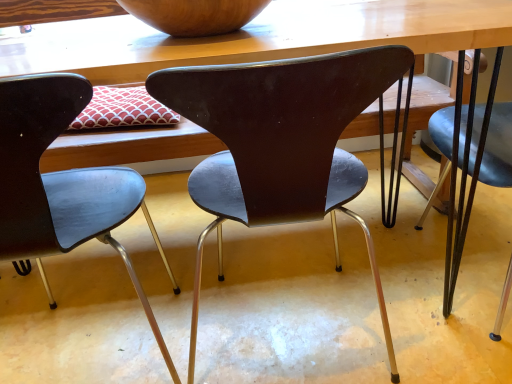
Describe the element at coordinates (61, 184) in the screenshot. I see `matte black chair at center, the 2th chair positioned from the right` at that location.

Locate an element on the screen. The width and height of the screenshot is (512, 384). wooden table at center is located at coordinates (258, 37).

This screenshot has width=512, height=384. Find the location of `table that appears above the matte black chair at center, positioned as the 2th chair in left-to-right order (from the image's perspective)`. table that appears above the matte black chair at center, positioned as the 2th chair in left-to-right order (from the image's perspective) is located at coordinates (258, 37).

Which of these two, wooden table at center or matte black chair at center, positioned as the 2th chair in left-to-right order, is smaller?

Smaller between the two is matte black chair at center, positioned as the 2th chair in left-to-right order.

Looking at this image, is wooden table at center oriented away from matte black chair at center, positioned as the 2th chair in left-to-right order?

Yes, wooden table at center's orientation is away from matte black chair at center, positioned as the 2th chair in left-to-right order.

Is wooden table at center completely or partially outside of matte black chair at center, positioned as the first chair in right-to-left order?

wooden table at center is positioned outside matte black chair at center, positioned as the first chair in right-to-left order.

Which is in front, point (196, 150) or point (42, 92)?

The point (42, 92) is closer.

Is wooden table at center positioned far away from matte black chair at center, the 2th chair positioned from the right?

That's not correct — wooden table at center is a little close to matte black chair at center, the 2th chair positioned from the right.

Considering the relative positions of wooden table at center and matte black chair at center, the 2th chair positioned from the right, in the image provided, is wooden table at center to the left of matte black chair at center, the 2th chair positioned from the right, from the viewer's perspective?

No, wooden table at center is not to the left of matte black chair at center, the 2th chair positioned from the right.

Based on the photo, considering the sizes of wooden table at center and matte black chair at center, which is the 1th chair from left to right, in the image, is wooden table at center wider or thinner than matte black chair at center, which is the 1th chair from left to right,?

Clearly, wooden table at center has more width compared to matte black chair at center, which is the 1th chair from left to right.

Does matte black chair at center, positioned as the first chair in right-to-left order, have a greater height compared to wooden bowl at upper center?

Yes.

Between matte black chair at center, positioned as the first chair in right-to-left order, and wooden bowl at upper center, which one has larger size?

Bigger between the two is matte black chair at center, positioned as the first chair in right-to-left order.

From a real-world perspective, which object rests below the other?

matte black chair at center, positioned as the first chair in right-to-left order, from a real-world perspective.

Looking at this image, is matte black chair at center, positioned as the first chair in right-to-left order, wider than wooden bowl at upper center?

Correct, the width of matte black chair at center, positioned as the first chair in right-to-left order, exceeds that of wooden bowl at upper center.

Is matte black chair at center, which is the 1th chair from left to right, at the left side of wooden bowl at upper center?

Yes.

Does matte black chair at center, the 2th chair positioned from the right, have a larger size compared to wooden bowl at upper center?

Yes, matte black chair at center, the 2th chair positioned from the right, is bigger than wooden bowl at upper center.

Is matte black chair at center, the 2th chair positioned from the right, aimed at wooden bowl at upper center?

No.

Are matte black chair at center, which is the 1th chair from left to right, and wooden bowl at upper center making contact?

matte black chair at center, which is the 1th chair from left to right, is not next to wooden bowl at upper center, and they're not touching.

Which object is wider, matte black chair at center, the 2th chair positioned from the right, or matte black chair at center, positioned as the 2th chair in left-to-right order?

Wider between the two is matte black chair at center, the 2th chair positioned from the right.

In the scene shown: How many degrees apart are the facing directions of matte black chair at center, which is the 1th chair from left to right, and matte black chair at center, positioned as the 2th chair in left-to-right order?

They differ by 5.83e-05 degrees in their facing directions.

Between point (25, 155) and point (245, 124), which one is positioned behind?

The point (25, 155) is farther.

Is matte black chair at center, the 2th chair positioned from the right, in contact with matte black chair at center, positioned as the first chair in right-to-left order?

They are not placed beside each other.

Consider the image. Is matte black chair at center, positioned as the first chair in right-to-left order, aimed at wooden table at center?

Yes, matte black chair at center, positioned as the first chair in right-to-left order, faces towards wooden table at center.

From the image's perspective, is matte black chair at center, positioned as the first chair in right-to-left order, above wooden table at center?

No, from the image's perspective, matte black chair at center, positioned as the first chair in right-to-left order, is not over wooden table at center.

Can you confirm if matte black chair at center, positioned as the first chair in right-to-left order, is shorter than wooden table at center?

Correct, matte black chair at center, positioned as the first chair in right-to-left order, is not as tall as wooden table at center.

Is point (156, 14) less distant than point (195, 139)?

That is True.

Considering the sizes of objects wooden bowl at upper center and wooden table at center in the image provided, who is bigger, wooden bowl at upper center or wooden table at center?

wooden table at center.

Who is more distant, wooden bowl at upper center or wooden table at center?

Positioned behind is wooden bowl at upper center.

How many degrees apart are the facing directions of wooden bowl at upper center and wooden table at center?

wooden bowl at upper center and wooden table at center are facing 3.6 degrees away from each other.

In order to click on table behind the matte black chair at center, positioned as the first chair in right-to-left order in this screenshot , I will do `click(258, 37)`.

Locate an element on the screen. table located above the matte black chair at center, the 2th chair positioned from the right (from the image's perspective) is located at coordinates (258, 37).

Which object lies nearer to the anchor point wooden table at center, wooden bowl at upper center or matte black chair at center, positioned as the 2th chair in left-to-right order?

Among the two, wooden bowl at upper center is located nearer to wooden table at center.

Considering their positions, is wooden table at center positioned further to matte black chair at center, which is the 1th chair from left to right, than wooden bowl at upper center?

Among the two, wooden bowl at upper center is located further to matte black chair at center, which is the 1th chair from left to right.

Consider the image. Which object lies nearer to the anchor point matte black chair at center, which is the 1th chair from left to right, wooden bowl at upper center or wooden table at center?

wooden table at center lies closer to matte black chair at center, which is the 1th chair from left to right, than the other object.

Estimate the real-world distances between objects in this image. Which object is further from wooden bowl at upper center, matte black chair at center, which is the 1th chair from left to right, or wooden table at center?

matte black chair at center, which is the 1th chair from left to right, is positioned further to the anchor wooden bowl at upper center.

Based on their spatial positions, is matte black chair at center, the 2th chair positioned from the right, or wooden bowl at upper center further from matte black chair at center, positioned as the first chair in right-to-left order?

wooden bowl at upper center is positioned further to the anchor matte black chair at center, positioned as the first chair in right-to-left order.

When comparing their distances from wooden bowl at upper center, does matte black chair at center, positioned as the first chair in right-to-left order, or matte black chair at center, the 2th chair positioned from the right, seem closer?

matte black chair at center, positioned as the first chair in right-to-left order, is positioned closer to the anchor wooden bowl at upper center.

Which object lies further to the anchor point matte black chair at center, which is the 1th chair from left to right, matte black chair at center, positioned as the first chair in right-to-left order, or wooden table at center?

wooden table at center.

From the image, which object appears to be farther from wooden bowl at upper center, matte black chair at center, which is the 1th chair from left to right, or matte black chair at center, positioned as the first chair in right-to-left order?

matte black chair at center, which is the 1th chair from left to right, is positioned further to the anchor wooden bowl at upper center.

Find the location of a particular element. table situated between matte black chair at center, the 2th chair positioned from the right, and matte black chair at center, positioned as the first chair in right-to-left order, from left to right is located at coordinates (258, 37).

Locate an element on the screen. Image resolution: width=512 pixels, height=384 pixels. table between wooden bowl at upper center and matte black chair at center, positioned as the 2th chair in left-to-right order, in the vertical direction is located at coordinates (258, 37).

The height and width of the screenshot is (384, 512). What are the coordinates of `table between wooden bowl at upper center and matte black chair at center, which is the 1th chair from left to right, vertically` in the screenshot? It's located at (258, 37).

The height and width of the screenshot is (384, 512). I want to click on chair that lies between wooden bowl at upper center and matte black chair at center, which is the 1th chair from left to right, from top to bottom, so click(280, 144).